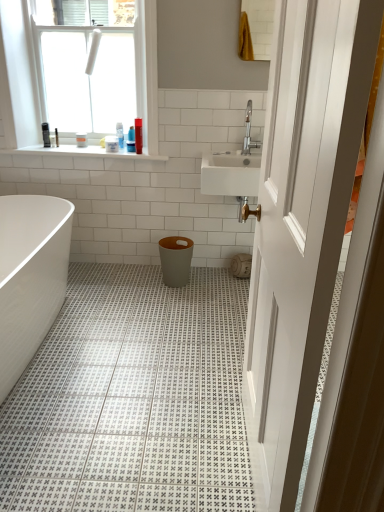
Question: Would you say matte gray trash can at center contains white plastic container at upper center?

Choices:
 (A) yes
 (B) no

Answer: (B)

Question: Is matte gray trash can at center in front of white plastic container at upper center?

Choices:
 (A) yes
 (B) no

Answer: (A)

Question: Does matte gray trash can at center have a greater height compared to white plastic container at upper center?

Choices:
 (A) yes
 (B) no

Answer: (A)

Question: Is matte gray trash can at center to the left of white plastic container at upper center from the viewer's perspective?

Choices:
 (A) yes
 (B) no

Answer: (B)

Question: Considering the relative sizes of matte gray trash can at center and white plastic container at upper center in the image provided, is matte gray trash can at center smaller than white plastic container at upper center?

Choices:
 (A) yes
 (B) no

Answer: (B)

Question: Is matte gray trash can at center positioned beyond the bounds of white plastic container at upper center?

Choices:
 (A) yes
 (B) no

Answer: (A)

Question: Is white glossy bathtub at lower left positioned beyond the bounds of silver metallic faucet at upper right?

Choices:
 (A) no
 (B) yes

Answer: (B)

Question: Can you confirm if white glossy bathtub at lower left is taller than silver metallic faucet at upper right?

Choices:
 (A) yes
 (B) no

Answer: (A)

Question: Does white glossy bathtub at lower left have a lesser height compared to silver metallic faucet at upper right?

Choices:
 (A) no
 (B) yes

Answer: (A)

Question: Is white glossy bathtub at lower left positioned before silver metallic faucet at upper right?

Choices:
 (A) no
 (B) yes

Answer: (B)

Question: Considering the relative sizes of white glossy bathtub at lower left and silver metallic faucet at upper right in the image provided, is white glossy bathtub at lower left thinner than silver metallic faucet at upper right?

Choices:
 (A) no
 (B) yes

Answer: (A)

Question: From the image's perspective, does white glossy bathtub at lower left appear higher than silver metallic faucet at upper right?

Choices:
 (A) no
 (B) yes

Answer: (A)

Question: Considering the relative sizes of silver metallic faucet at upper right and white glossy bathtub at lower left in the image provided, is silver metallic faucet at upper right smaller than white glossy bathtub at lower left?

Choices:
 (A) no
 (B) yes

Answer: (B)